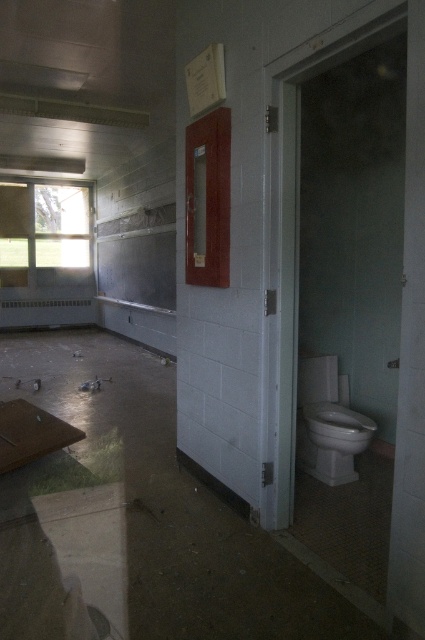
Who is more distant from viewer, (220, 284) or (331, 465)?

The point (331, 465) is behind.

Is wooden frame at upper center positioned at the back of white glossy toilet at lower right?

That is False.

Is point (198, 260) more distant than point (336, 403)?

No.

Find the location of a particular element. wooden frame at upper center is located at coordinates (207, 198).